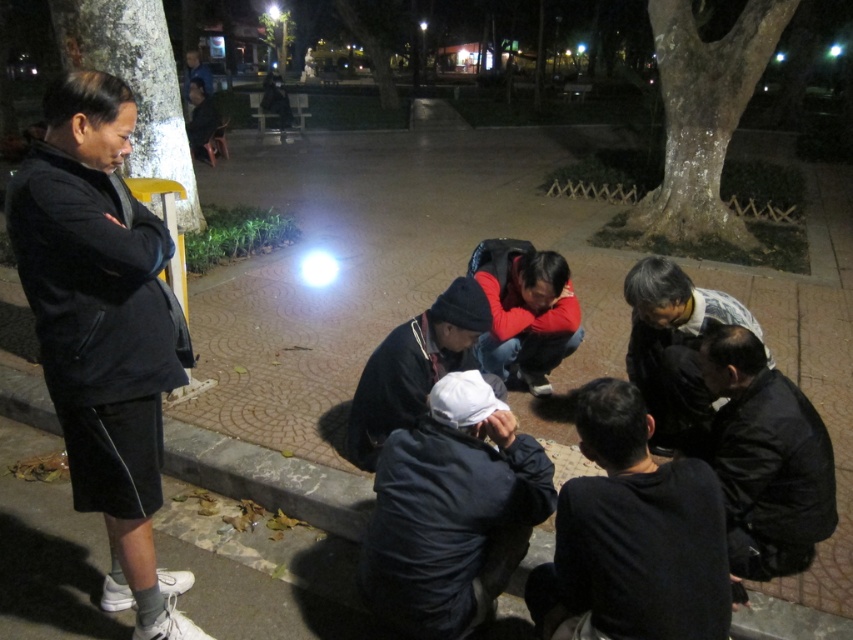
You are standing at the center of the circular paved area in the park. You notice a dark matte jacket at lower center. Can you estimate its position relative to your current location using the coordinate system provided?

The dark matte jacket at lower center is located at point 0.834 on the x and 0.744 on the y axis. Since you are at the center, which is typically at coordinates (426, 320), the jacket is positioned to the right and slightly below your current position.

You are standing in the park and see two jackets in the scene. The dark gray jacket at lower right and the black matte jacket at center. Which jacket is positioned to the right of the other?

The dark gray jacket at lower right is to the right of the black matte jacket at center.